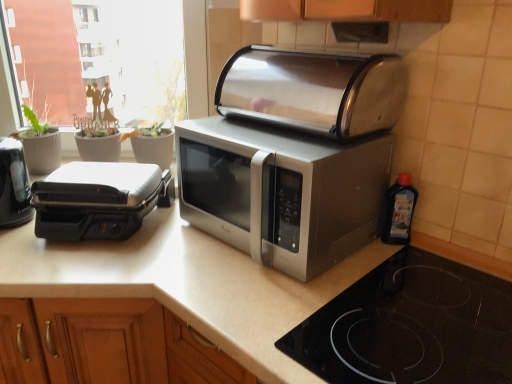
Question: Considering the positions of transparent plastic window screen at upper left and black glass cooktop at lower right in the image, is transparent plastic window screen at upper left wider or thinner than black glass cooktop at lower right?

Choices:
 (A) wide
 (B) thin

Answer: (B)

Question: Is transparent plastic window screen at upper left to the left or to the right of black glass cooktop at lower right in the image?

Choices:
 (A) left
 (B) right

Answer: (A)

Question: Which of these objects is positioned closest to the stainless steel toaster at center, the first toaster positioned from the right?

Choices:
 (A) satin silver microwave at center
 (B) black plastic toaster at left, which is the 2th toaster in left-to-right order
 (C) transparent plastic bottle at right
 (D) black plastic toaster at left, which ranks as the 3th toaster in right-to-left order
 (E) transparent plastic window screen at upper left

Answer: (A)

Question: Considering the real-world distances, which object is farthest from the stainless steel toaster at center, the 3th toaster viewed from the left?

Choices:
 (A) transparent plastic bottle at right
 (B) black glass cooktop at lower right
 (C) black plastic toaster at left, which ranks as the 3th toaster in right-to-left order
 (D) black plastic toaster at left, which appears as the 2th toaster when viewed from the right
 (E) white matte countertop at center

Answer: (C)